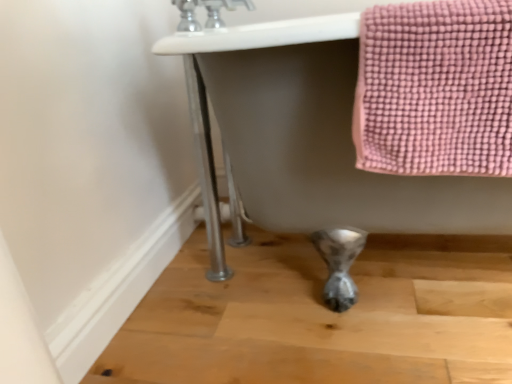
Question: Should I look upward or downward to see silver metallic faucet at upper center?

Choices:
 (A) up
 (B) down

Answer: (A)

Question: Considering the relative positions of white glossy bathtub at center and silver metallic faucet at upper center in the image provided, is white glossy bathtub at center to the left of silver metallic faucet at upper center from the viewer's perspective?

Choices:
 (A) no
 (B) yes

Answer: (A)

Question: From a real-world perspective, is white glossy bathtub at center positioned over silver metallic faucet at upper center based on gravity?

Choices:
 (A) yes
 (B) no

Answer: (B)

Question: Considering the relative sizes of white glossy bathtub at center and silver metallic faucet at upper center in the image provided, is white glossy bathtub at center wider than silver metallic faucet at upper center?

Choices:
 (A) no
 (B) yes

Answer: (B)

Question: Does white glossy bathtub at center come in front of silver metallic faucet at upper center?

Choices:
 (A) yes
 (B) no

Answer: (A)

Question: From a real-world perspective, is white glossy bathtub at center located beneath silver metallic faucet at upper center?

Choices:
 (A) no
 (B) yes

Answer: (B)

Question: Is white glossy bathtub at center bigger than silver metallic faucet at upper center?

Choices:
 (A) yes
 (B) no

Answer: (A)

Question: Does silver metallic faucet at upper center appear on the right side of white glossy bathtub at center?

Choices:
 (A) yes
 (B) no

Answer: (B)

Question: Considering the relative sizes of silver metallic faucet at upper center and white glossy bathtub at center in the image provided, is silver metallic faucet at upper center shorter than white glossy bathtub at center?

Choices:
 (A) no
 (B) yes

Answer: (B)

Question: From a real-world perspective, is silver metallic faucet at upper center below white glossy bathtub at center?

Choices:
 (A) no
 (B) yes

Answer: (A)

Question: Can you confirm if silver metallic faucet at upper center is bigger than white glossy bathtub at center?

Choices:
 (A) yes
 (B) no

Answer: (B)

Question: Is silver metallic faucet at upper center beside white glossy bathtub at center?

Choices:
 (A) yes
 (B) no

Answer: (B)

Question: Considering the relative positions of silver metallic faucet at upper center and white glossy bathtub at center in the image provided, is silver metallic faucet at upper center to the left of white glossy bathtub at center from the viewer's perspective?

Choices:
 (A) yes
 (B) no

Answer: (A)

Question: Do you think white glossy bathtub at center is within silver metallic faucet at upper center, or outside of it?

Choices:
 (A) outside
 (B) inside

Answer: (A)